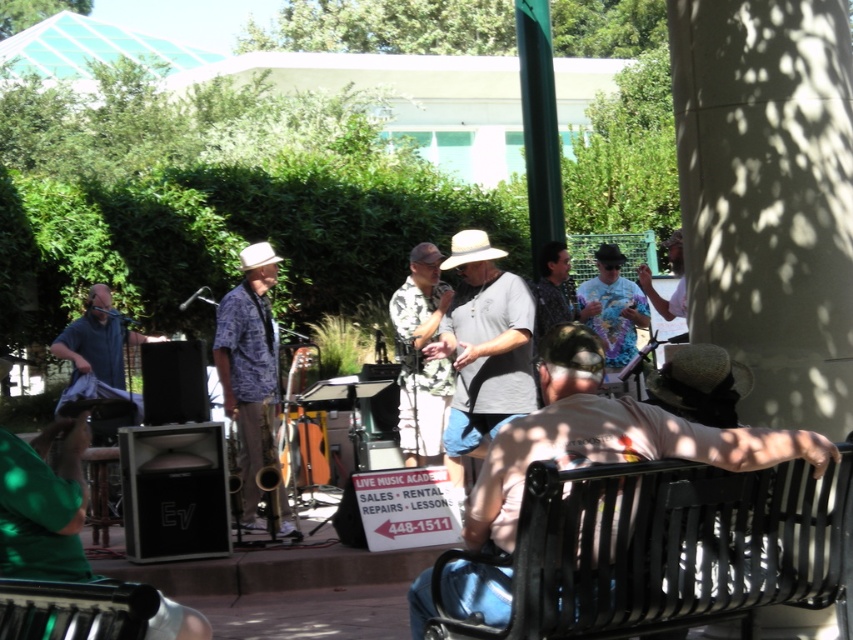
Question: Based on their relative distances, which object is farther from the brown leather hat at lower right?

Choices:
 (A) floral shirt at center
 (B) blue floral shirt at center
 (C) gray cotton shirt at center

Answer: (B)

Question: Is floral shirt at center above tie-dye shirt at center?

Choices:
 (A) no
 (B) yes

Answer: (A)

Question: Estimate the real-world distances between objects in this image. Which object is farther from the gray cotton shirt at center?

Choices:
 (A) brown leather hat at lower right
 (B) blue fabric shirt at left
 (C) floral shirt at center

Answer: (B)

Question: Which object appears closest to the camera in this image?

Choices:
 (A) blue fabric shirt at left
 (B) brown leather hat at lower right
 (C) floral shirt at center

Answer: (B)

Question: Is floral shirt at center above blue fabric shirt at left?

Choices:
 (A) yes
 (B) no

Answer: (A)

Question: Does blue floral shirt at center have a smaller size compared to floral shirt at center?

Choices:
 (A) yes
 (B) no

Answer: (B)